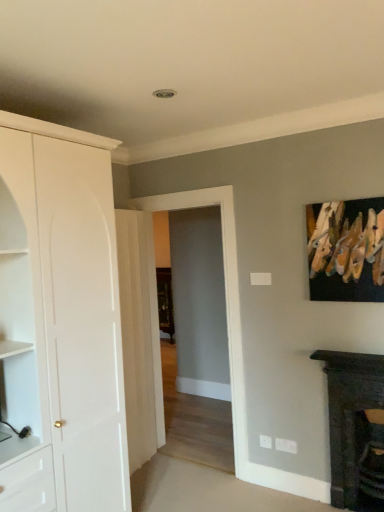
The width and height of the screenshot is (384, 512). I want to click on vacant region under wooden clothespins at upper right (from a real-world perspective), so click(x=356, y=348).